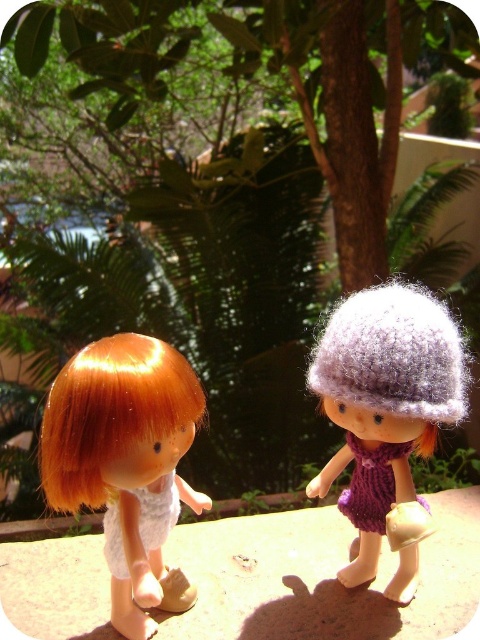
Is point (87, 392) closer to camera compared to point (421, 500)?

Yes, it is in front of point (421, 500).

Does shiny orange hair at center appear on the right side of purple knitted hat at right?

No, shiny orange hair at center is not to the right of purple knitted hat at right.

The image size is (480, 640). I want to click on shiny orange hair at center, so click(x=123, y=458).

The image size is (480, 640). In order to click on shiny orange hair at center in this screenshot , I will do 123,458.